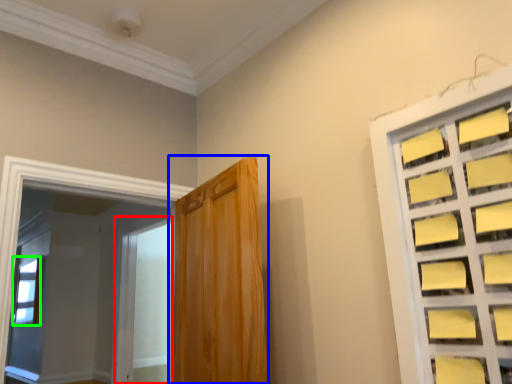
Question: Estimate the real-world distances between objects in this image. Which object is farther from screen door (highlighted by a red box), door (highlighted by a blue box) or window (highlighted by a green box)?

Choices:
 (A) door
 (B) window

Answer: (A)